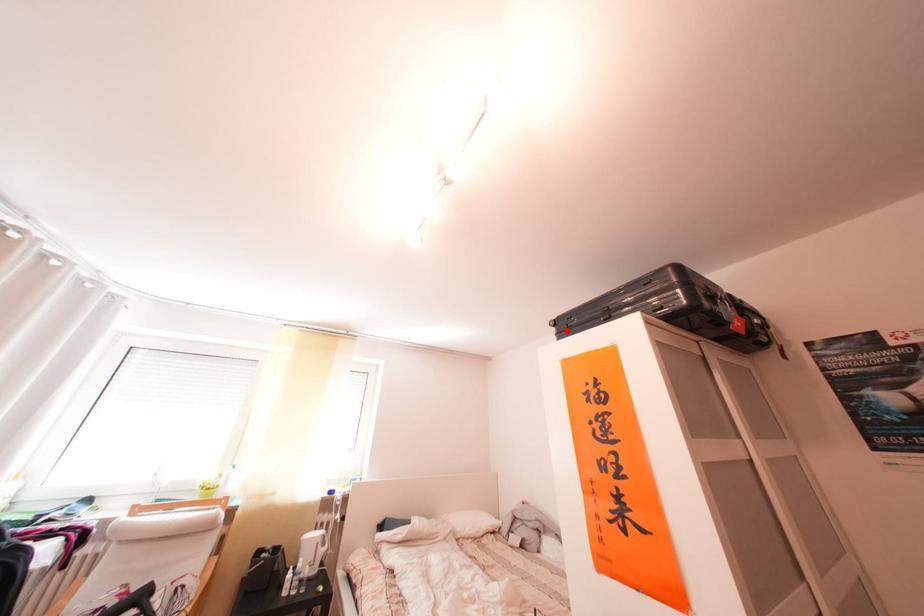
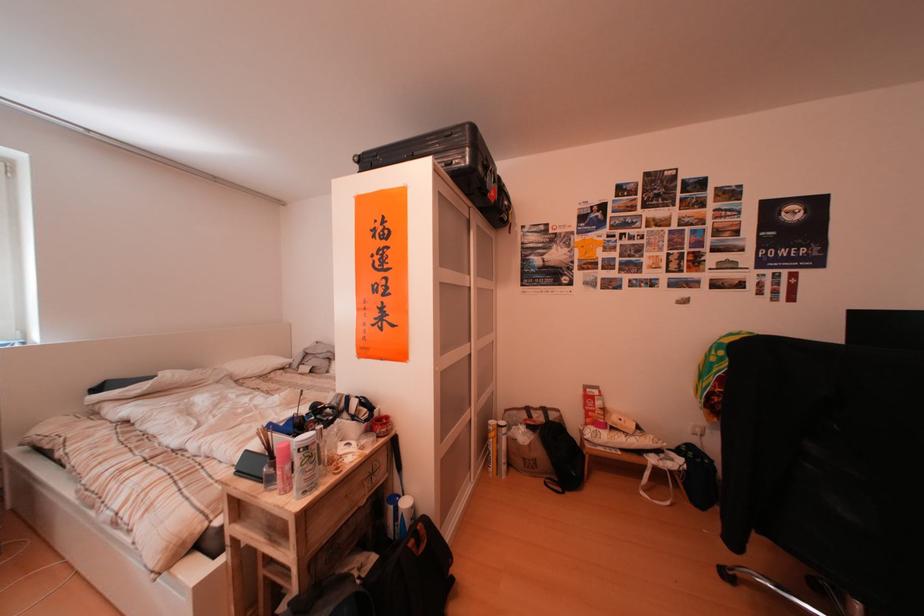
Question: I am providing you with two images of the same scene from different viewpoints. A red point is shown in image1. For the corresponding object point in image2, is it positioned nearer or farther from the camera?

Choices:
 (A) Nearer
 (B) Farther

Answer: (A)